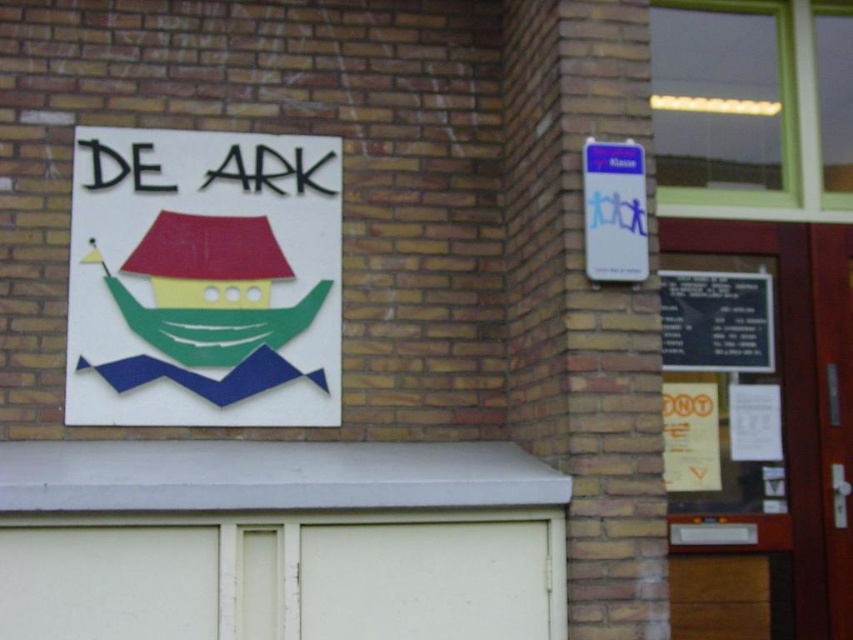
Can you confirm if matte plastic sign at upper left is smaller than black matte signboard at right?

No.

Is matte plastic sign at upper left positioned in front of black matte signboard at right?

Yes, matte plastic sign at upper left is in front of black matte signboard at right.

Which is in front, point (170, 218) or point (670, 316)?

Point (170, 218)

The height and width of the screenshot is (640, 853). I want to click on matte plastic sign at upper left, so click(x=204, y=280).

Does black matte signboard at right have a lesser height compared to blue paper sign at upper right?

Yes, black matte signboard at right is shorter than blue paper sign at upper right.

Which is more to the right, black matte signboard at right or blue paper sign at upper right?

From the viewer's perspective, black matte signboard at right appears more on the right side.

Which is behind, point (689, 312) or point (595, 164)?

Point (689, 312)

I want to click on black matte signboard at right, so click(717, 321).

Looking at this image, between matte plastic sign at upper left and blue paper sign at upper right, which one is positioned higher?

A: blue paper sign at upper right

Which is in front, point (99, 241) or point (624, 273)?

Point (624, 273) is more forward.

The image size is (853, 640). Find the location of `matte plastic sign at upper left`. matte plastic sign at upper left is located at coordinates (204, 280).